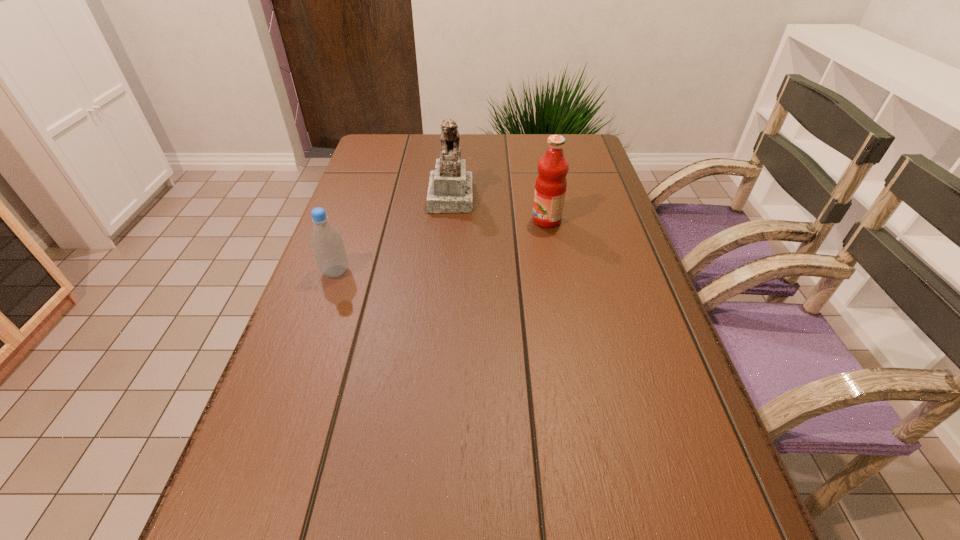
At what (x,y) coordinates should I click in order to perform the action: click on the second object from left to right. Please return your answer as a coordinate pair (x, y). This screenshot has width=960, height=540. Looking at the image, I should click on (450, 186).

Where is `the rightmost object`? the rightmost object is located at coordinates (550, 188).

Locate an element on the screen. The width and height of the screenshot is (960, 540). the leftmost object is located at coordinates (327, 245).

Image resolution: width=960 pixels, height=540 pixels. Find the location of `the nearest object`. the nearest object is located at coordinates (327, 245).

Identify the location of free space located 0.300m on the front-facing side of the second object from right to left. This screenshot has height=540, width=960. (580, 195).

Locate an element on the screen. The width and height of the screenshot is (960, 540). free space located on the front label of the fruit juice is located at coordinates (x=397, y=220).

Find the location of a particular element. This screenshot has width=960, height=540. free space located on the front label of the fruit juice is located at coordinates (428, 220).

The image size is (960, 540). I want to click on free space located 0.370m on the front label of the fruit juice, so click(x=390, y=220).

Find the location of a particular element. The width and height of the screenshot is (960, 540). vacant space situated 0.390m on the back of the nearest object is located at coordinates (370, 176).

The image size is (960, 540). I want to click on object present at the left edge, so click(327, 245).